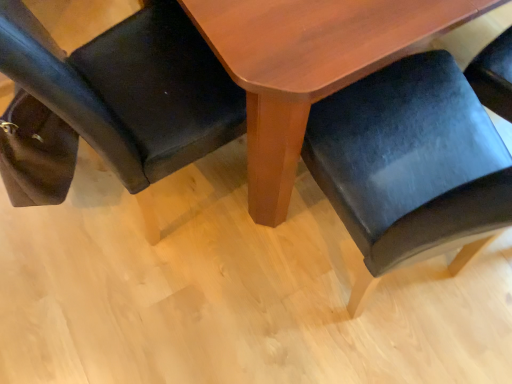
The height and width of the screenshot is (384, 512). Find the location of `free space to the left of velvet black chair at lower right, acting as the 2th chair starting from the left`. free space to the left of velvet black chair at lower right, acting as the 2th chair starting from the left is located at coordinates (221, 295).